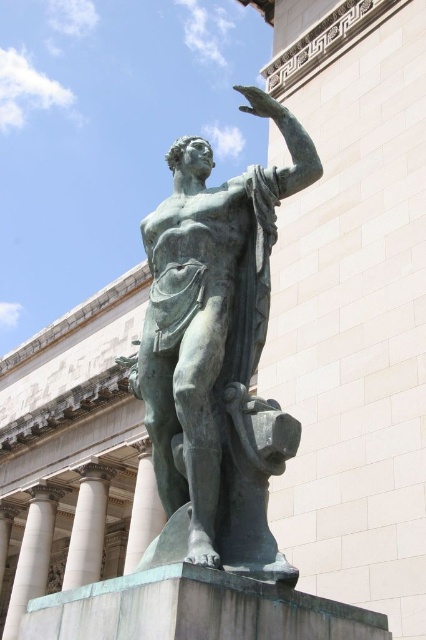
Based on the scene description, where is the green patina statue at center located in terms of its 2D coordinates?

The green patina statue at center is located at the 2D coordinates of point (x=215, y=355).

You are an art conservator assessing the space between the green patina statue at center and the white marble pillar at lower left. What can you infer about their relative sizes based on their widths?

The green patina statue at center has a lesser width compared to the white marble pillar at lower left, so the statue is narrower than the pillar.